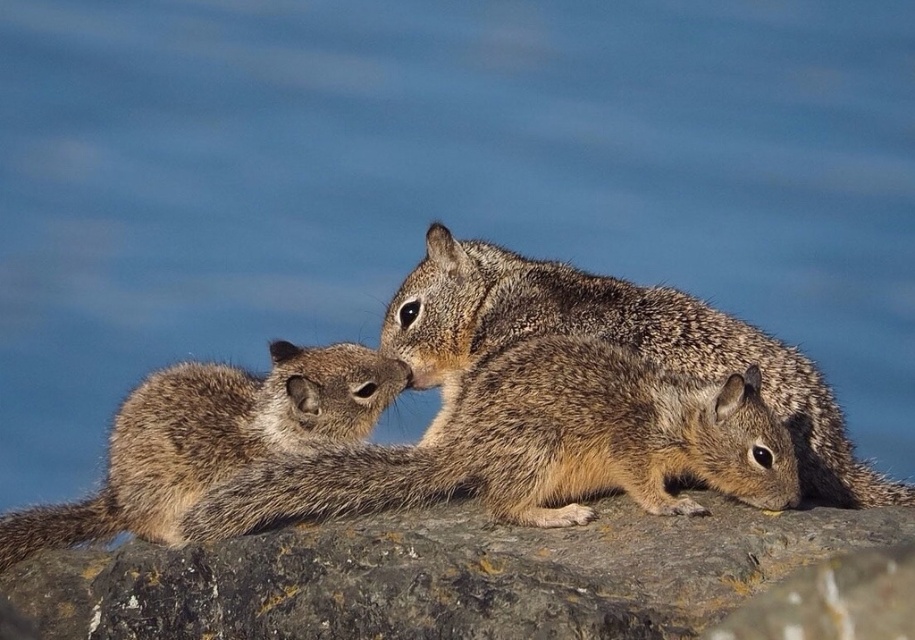
Which is below, brown rough rock at center or fuzzy brown squirrel at center?

brown rough rock at center

Can you confirm if brown rough rock at center is positioned to the right of fuzzy brown squirrel at center?

No, brown rough rock at center is not to the right of fuzzy brown squirrel at center.

Is point (147, 614) positioned after point (590, 307)?

That is False.

Find the location of a particular element. brown rough rock at center is located at coordinates (443, 576).

Is brown furry squirrel at center further to camera compared to brown speckled squirrel at left?

No, it is not.

Is point (483, 426) closer to camera compared to point (327, 438)?

Yes, point (483, 426) is in front of point (327, 438).

Locate an element on the screen. This screenshot has width=915, height=640. brown furry squirrel at center is located at coordinates (537, 445).

Is brown rough rock at center bigger than brown furry squirrel at center?

Indeed, brown rough rock at center has a larger size compared to brown furry squirrel at center.

Does brown rough rock at center have a greater height compared to brown furry squirrel at center?

In fact, brown rough rock at center may be shorter than brown furry squirrel at center.

What do you see at coordinates (443, 576) in the screenshot? I see `brown rough rock at center` at bounding box center [443, 576].

Find the location of a particular element. The height and width of the screenshot is (640, 915). brown rough rock at center is located at coordinates (443, 576).